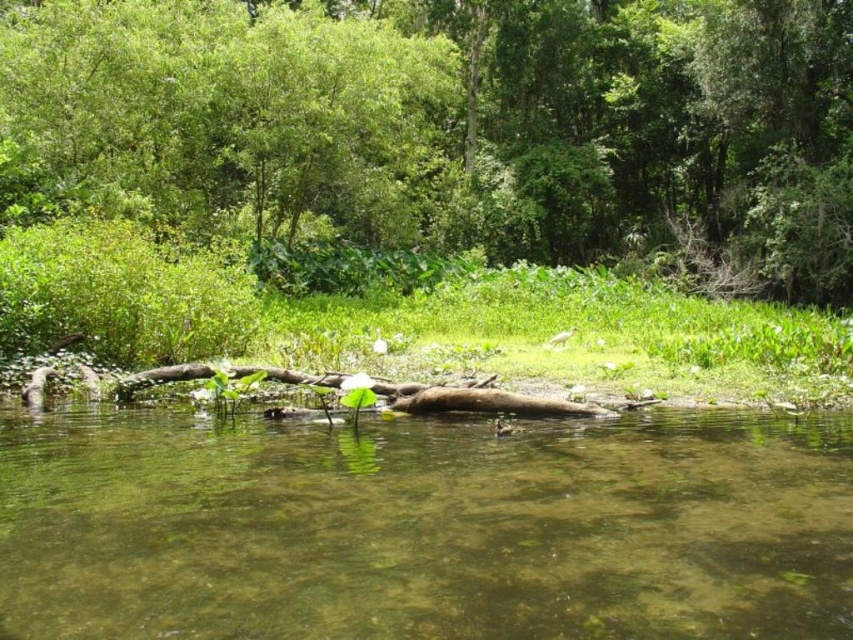
The width and height of the screenshot is (853, 640). Find the location of `green leafy tree at upper center`. green leafy tree at upper center is located at coordinates (451, 125).

Between point (306, 189) and point (670, 529), which one is positioned in front?

Point (670, 529)

Measure the distance between point (729,140) and camera.

They are 129.21 feet apart.

Where is `green leafy tree at upper center`? green leafy tree at upper center is located at coordinates (451, 125).